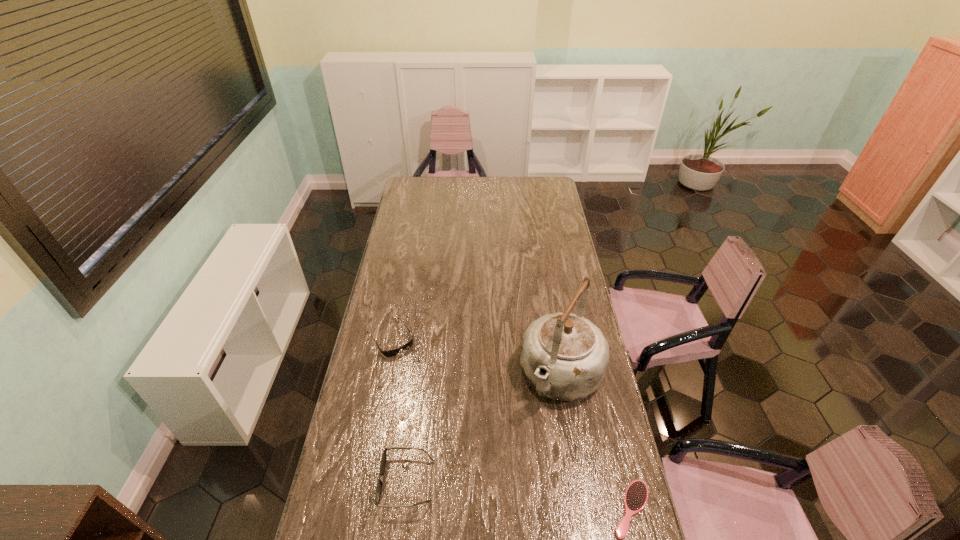
Where is `vacant space that satisfies the following two spatial constraints: 1. on the front side of the nearer sunglasses; 2. on the front-facing side of the farther sunglasses`? vacant space that satisfies the following two spatial constraints: 1. on the front side of the nearer sunglasses; 2. on the front-facing side of the farther sunglasses is located at coordinates (363, 481).

Where is `vacant position in the image that satisfies the following two spatial constraints: 1. on the front side of the hairbrush; 2. on the right side of the tallest object`? The width and height of the screenshot is (960, 540). vacant position in the image that satisfies the following two spatial constraints: 1. on the front side of the hairbrush; 2. on the right side of the tallest object is located at coordinates (584, 509).